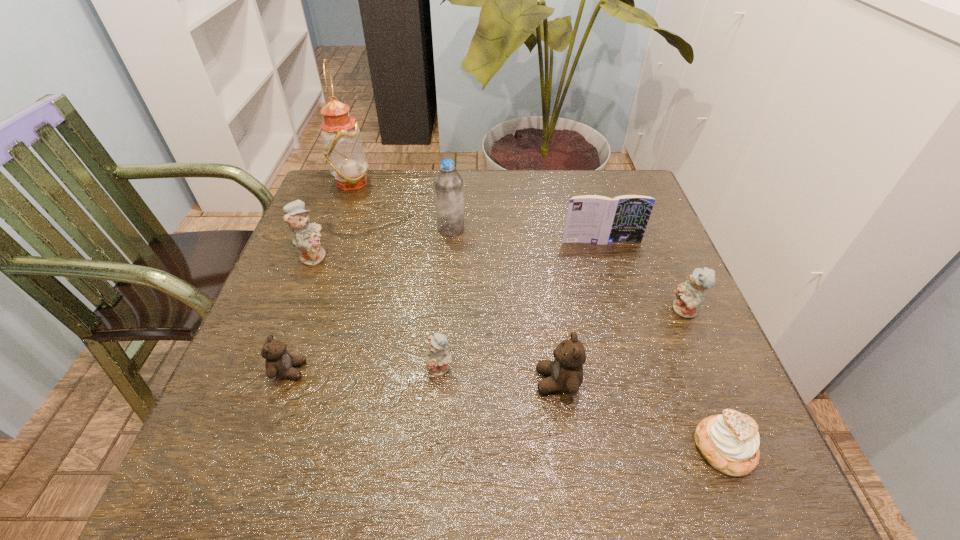
Identify the location of the fourth object from right to left. This screenshot has width=960, height=540. (566, 372).

Image resolution: width=960 pixels, height=540 pixels. I want to click on the smaller brown teddy bear, so click(x=279, y=363).

Where is `the third teddy bear from right to left`? the third teddy bear from right to left is located at coordinates (437, 361).

Where is `the second blue teddy bear from right to left`? The image size is (960, 540). the second blue teddy bear from right to left is located at coordinates (437, 361).

Locate an element on the screen. This screenshot has width=960, height=540. the nearest object is located at coordinates (730, 442).

Image resolution: width=960 pixels, height=540 pixels. In order to click on vacant space situated 0.300m on the front of the oil lamp in this screenshot , I will do `click(320, 268)`.

Where is `free region located on the right of the eighth nearest object`? The height and width of the screenshot is (540, 960). free region located on the right of the eighth nearest object is located at coordinates (528, 229).

Find the location of a particular element. The width and height of the screenshot is (960, 540). vacant space located on the front-facing side of the tallest teddy bear is located at coordinates (433, 255).

You are a GUI agent. You are given a task and a screenshot of the screen. Output one action in this format:
    pyautogui.click(x=<x>, y=<y>)
    Task: Click on the free location located on the front cover of the book
    
    Given the screenshot: What is the action you would take?
    pyautogui.click(x=634, y=349)

Where is `free space located 0.250m on the front-facing side of the second nearest blue teddy bear`? free space located 0.250m on the front-facing side of the second nearest blue teddy bear is located at coordinates (553, 310).